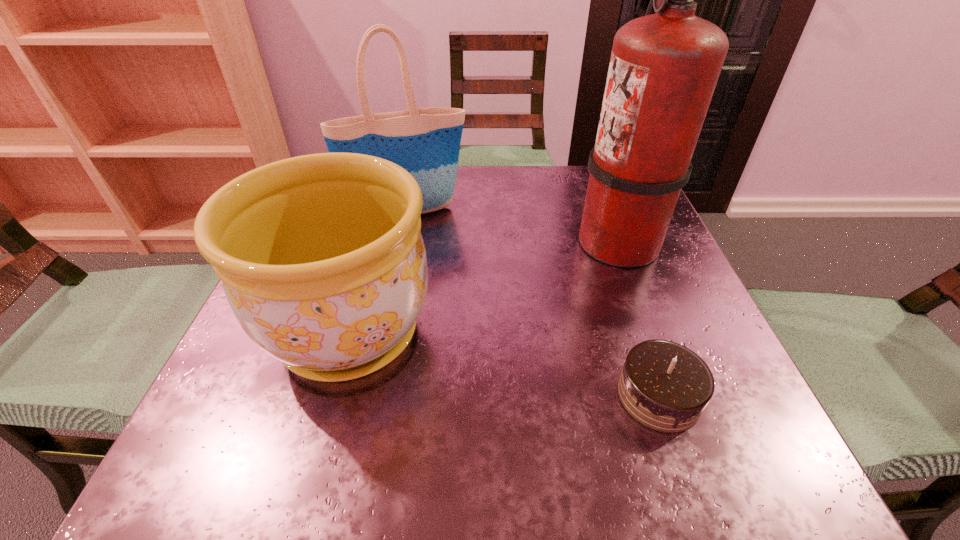
In the image, there is a desktop. Identify the location of vacant space at the far edge. The image size is (960, 540). (525, 203).

Where is `free spot at the near edge of the desktop`? The width and height of the screenshot is (960, 540). free spot at the near edge of the desktop is located at coordinates (535, 447).

Identify the location of free space at the left edge of the desktop. The width and height of the screenshot is (960, 540). (283, 367).

Where is `free space at the right edge of the desktop`? Image resolution: width=960 pixels, height=540 pixels. free space at the right edge of the desktop is located at coordinates (596, 270).

Image resolution: width=960 pixels, height=540 pixels. Find the location of `vacant position at the far right corner of the desktop`. vacant position at the far right corner of the desktop is located at coordinates (567, 166).

The image size is (960, 540). What are the coordinates of `vacant region at the near right corner of the desktop` in the screenshot? It's located at (682, 460).

Find the location of `free space between the fire extinguisher and the flowerpot`. free space between the fire extinguisher and the flowerpot is located at coordinates [484, 287].

The height and width of the screenshot is (540, 960). In order to click on empty space that is in between the flowerpot and the tallest object in this screenshot , I will do `click(484, 287)`.

Image resolution: width=960 pixels, height=540 pixels. Identify the location of free space between the flowerpot and the shortest object. (504, 364).

This screenshot has width=960, height=540. I want to click on free space that is in between the third shortest object and the fire extinguisher, so click(x=513, y=227).